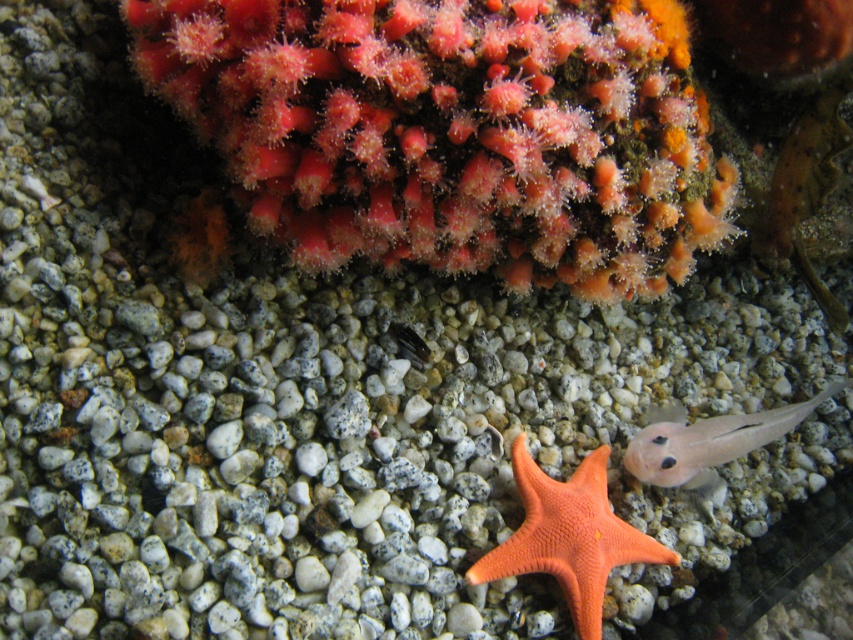
Can you confirm if smooth coral at upper center is shorter than translucent pink fish at lower right?

No.

Is point (483, 160) behind point (677, 456)?

No, (483, 160) is in front of (677, 456).

Locate an element on the screen. This screenshot has height=640, width=853. smooth coral at upper center is located at coordinates (453, 131).

Which is more to the right, smooth coral at upper center or orange matte starfish at center?

orange matte starfish at center is more to the right.

Based on the photo, does smooth coral at upper center have a greater width compared to orange matte starfish at center?

Indeed, smooth coral at upper center has a greater width compared to orange matte starfish at center.

Is point (624, 54) closer to camera compared to point (544, 497)?

Yes, point (624, 54) is in front of point (544, 497).

I want to click on smooth coral at upper center, so click(453, 131).

Who is more distant from viewer, (492, 560) or (688, 464)?

The point (688, 464) is behind.

The width and height of the screenshot is (853, 640). I want to click on orange matte starfish at center, so click(567, 536).